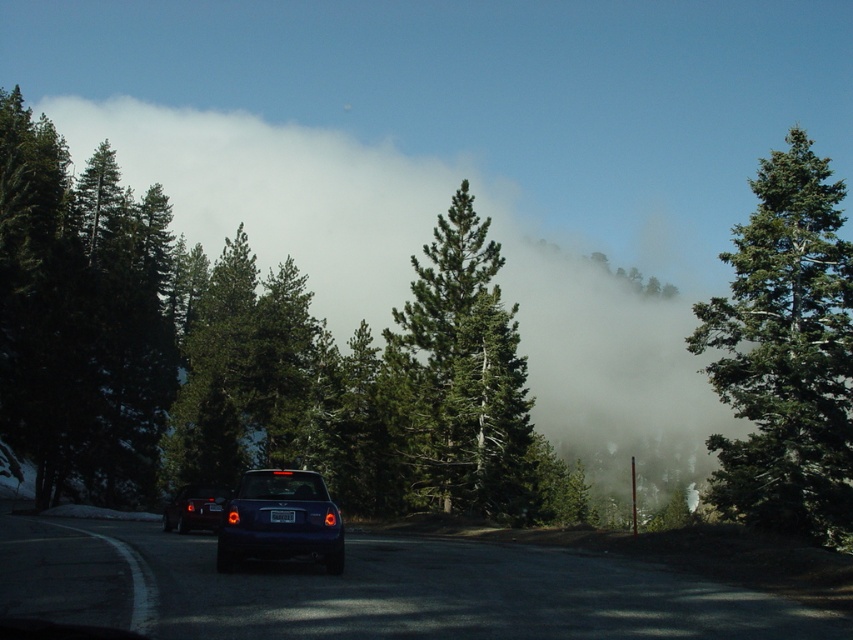
Question: Based on their relative distances, which object is nearer to the green textured pine tree at center?

Choices:
 (A) glossy black car at lower left
 (B) green matte tree at right
 (C) white foggy cloud at upper center
 (D) glossy blue car at center

Answer: (A)

Question: In this image, where is green matte tree at right located relative to glossy black car at lower left?

Choices:
 (A) left
 (B) right

Answer: (B)

Question: Can you confirm if glossy blue car at center is positioned above black plastic license plate at center?

Choices:
 (A) no
 (B) yes

Answer: (A)

Question: Among these objects, which one is farthest from the camera?

Choices:
 (A) white foggy cloud at upper center
 (B) glossy blue car at center
 (C) black plastic license plate at center

Answer: (A)

Question: Which point appears farthest from the camera in this image?

Choices:
 (A) (283, 520)
 (B) (421, 413)
 (C) (207, 524)

Answer: (B)

Question: Can you confirm if green matte tree at right is positioned to the right of black plastic license plate at center?

Choices:
 (A) yes
 (B) no

Answer: (A)